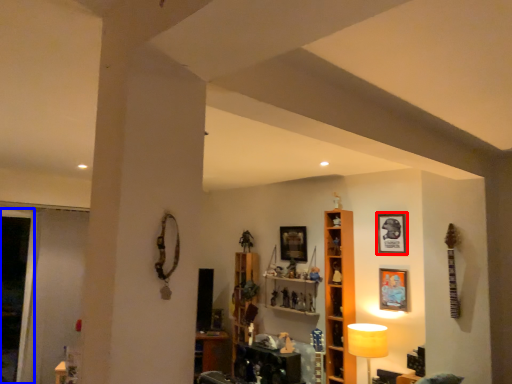
Question: Which of the following is the farthest to the observer, picture frame (highlighted by a red box) or glass door (highlighted by a blue box)?

Choices:
 (A) picture frame
 (B) glass door

Answer: (B)